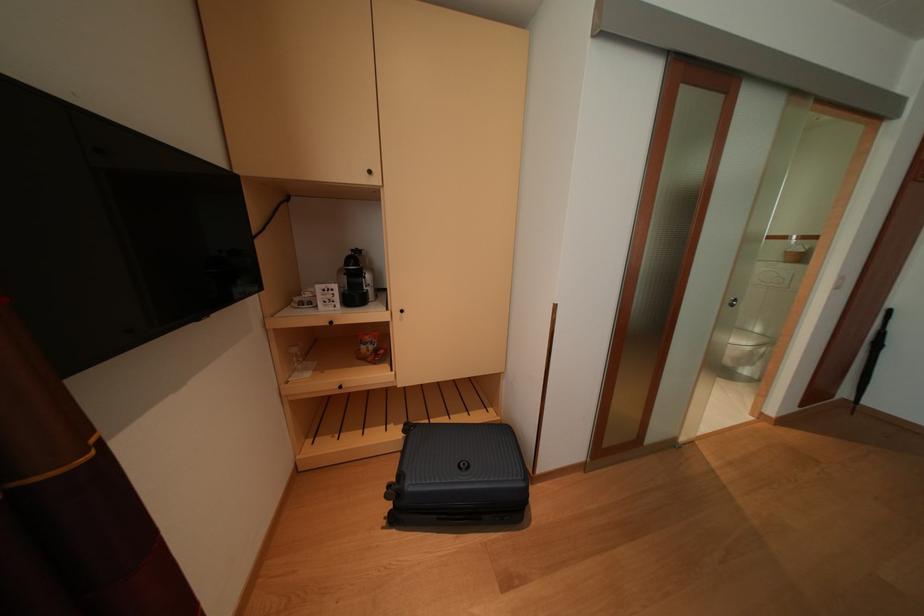
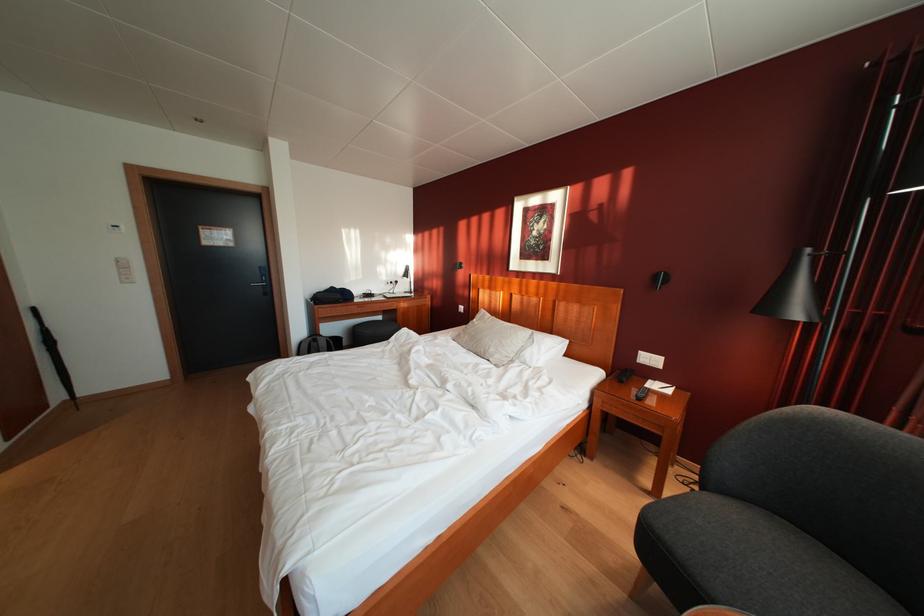
The first image is from the beginning of the video and the second image is from the end. How did the camera likely rotate when shooting the video?

The camera's rotation is toward right-down.